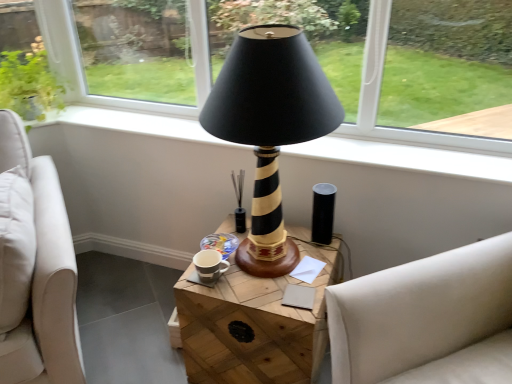
Question: Considering the relative sizes of black glossy candle holder at center and wooden at center in the image provided, is black glossy candle holder at center bigger than wooden at center?

Choices:
 (A) no
 (B) yes

Answer: (A)

Question: Is black glossy candle holder at center smaller than wooden at center?

Choices:
 (A) no
 (B) yes

Answer: (B)

Question: Is there a large distance between black glossy candle holder at center and wooden at center?

Choices:
 (A) yes
 (B) no

Answer: (B)

Question: From a real-world perspective, is black glossy candle holder at center located higher than wooden at center?

Choices:
 (A) no
 (B) yes

Answer: (B)

Question: Is black glossy candle holder at center behind wooden at center?

Choices:
 (A) no
 (B) yes

Answer: (B)

Question: Is black glossy candle holder at center closer to camera compared to wooden at center?

Choices:
 (A) yes
 (B) no

Answer: (B)

Question: Is wooden at center taller than black glossy candle holder at center?

Choices:
 (A) no
 (B) yes

Answer: (B)

Question: Does wooden at center appear on the right side of black glossy candle holder at center?

Choices:
 (A) yes
 (B) no

Answer: (A)

Question: Does wooden at center come behind black glossy candle holder at center?

Choices:
 (A) no
 (B) yes

Answer: (A)

Question: Is wooden at center at the left side of black glossy candle holder at center?

Choices:
 (A) no
 (B) yes

Answer: (A)

Question: Can you confirm if wooden at center is bigger than black glossy candle holder at center?

Choices:
 (A) yes
 (B) no

Answer: (A)

Question: Does wooden at center have a greater width compared to black glossy candle holder at center?

Choices:
 (A) no
 (B) yes

Answer: (B)

Question: Is white fabric studio couch at right positioned in front of wooden at center?

Choices:
 (A) no
 (B) yes

Answer: (B)